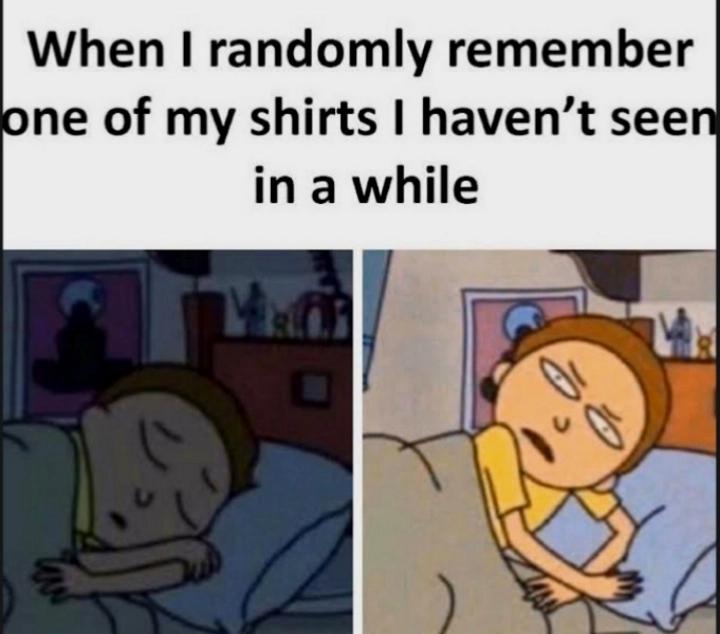
Where is `picture on wall`? This screenshot has height=634, width=720. picture on wall is located at coordinates (90, 328), (497, 319).